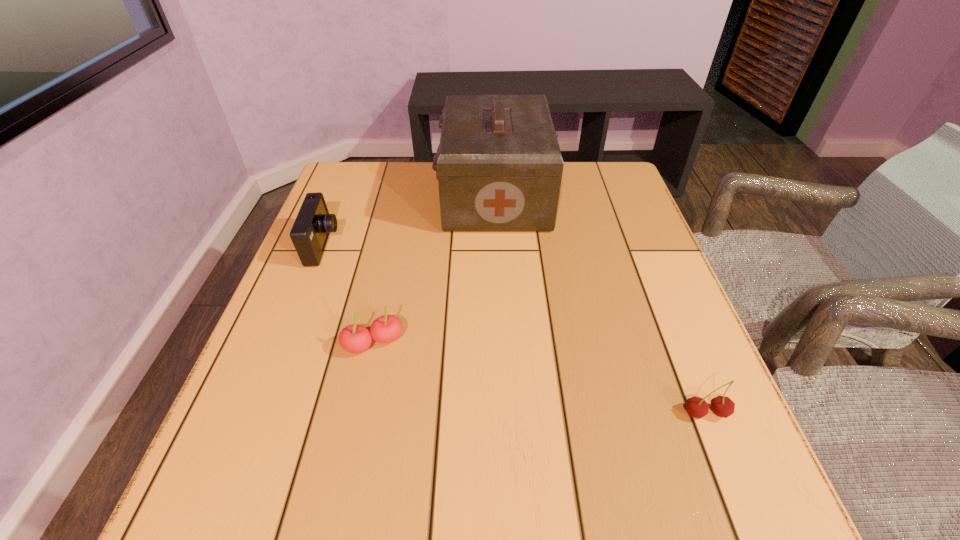
Locate an element on the screen. This screenshot has width=960, height=540. the third object from left to right is located at coordinates (499, 167).

This screenshot has width=960, height=540. I want to click on the first-aid kit, so click(x=499, y=167).

Identify the location of the leftmost object. (310, 232).

Locate an element on the screen. the nearest object is located at coordinates (722, 406).

I want to click on the right cherry, so [722, 406].

Find the location of a particular element. Image resolution: width=960 pixels, height=540 pixels. the farther cherry is located at coordinates (355, 339).

Where is `the left cherry`? the left cherry is located at coordinates (355, 339).

Image resolution: width=960 pixels, height=540 pixels. I want to click on free region located on the front of the tallest object, so click(x=501, y=332).

Image resolution: width=960 pixels, height=540 pixels. What are the coordinates of `free space located on the front-facing side of the camera` in the screenshot? It's located at (363, 247).

You are a GUI agent. You are given a task and a screenshot of the screen. Output one action in this format:
    pyautogui.click(x=<x>, y=<y>)
    Task: Click on the vacant space positioned on the surface of the nearest object
    The height and width of the screenshot is (540, 960).
    Given the screenshot: What is the action you would take?
    pyautogui.click(x=743, y=507)